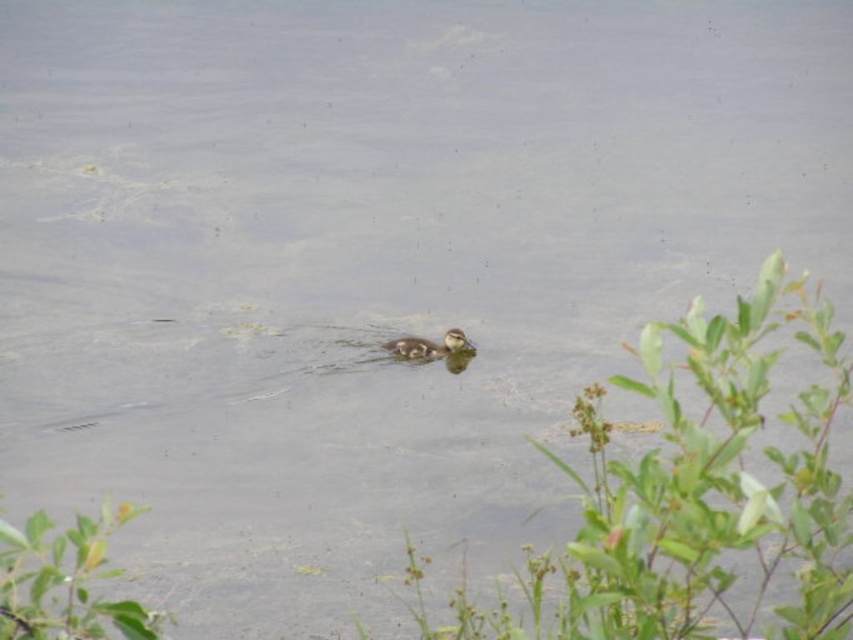
You are a photographer aiming to capture a closeup of the brown fuzzy duckling at center while ensuring the green leafy plant at lower left is partially visible in the background. Is the duckling positioned far enough from the plant to allow for this composition?

The green leafy plant at lower left might be wider than brown fuzzy duckling at center, so the duckling may be close enough to the plant to allow partial visibility in the background while focusing on the duckling.

You are a photographer trying to capture the brown fuzzy duckling at center and the green leafy plant at center in the same frame. Based on their positions, which one should you focus on first to ensure both are in focus?

The green leafy plant at center is below the brown fuzzy duckling at center, so you should focus on the duckling first as it is closer to the camera, ensuring both will be in focus when focusing on it.